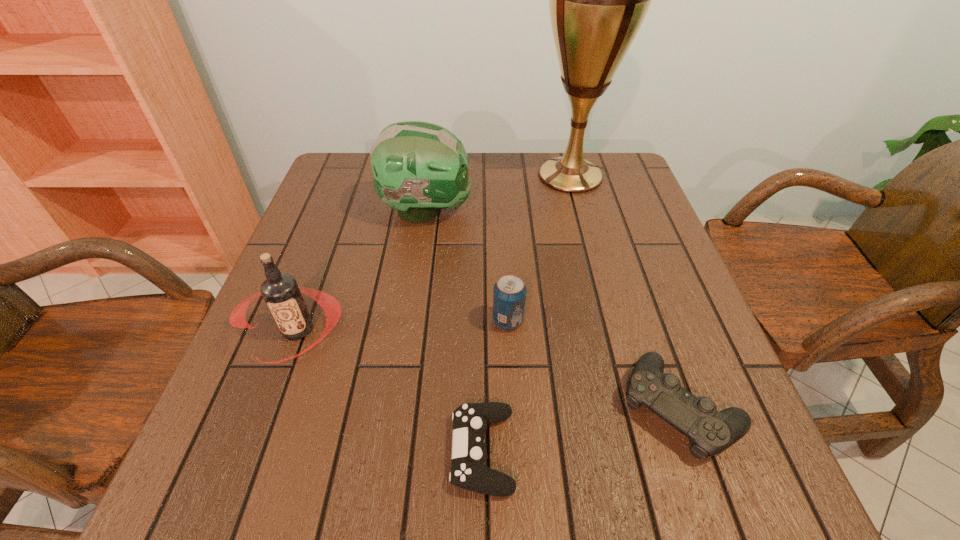
The height and width of the screenshot is (540, 960). I want to click on vacant area that lies between the fifth shortest object and the fourth tallest object, so click(467, 266).

Identify the location of vacant area between the taller control and the tallest object. The image size is (960, 540). (625, 292).

Find the location of a particular element. This screenshot has height=540, width=960. vacant space in between the tallest object and the pop soda is located at coordinates (540, 248).

Image resolution: width=960 pixels, height=540 pixels. In order to click on empty space that is in between the fourth tallest object and the leftmost object in this screenshot , I will do `click(403, 326)`.

At what (x,y) coordinates should I click in order to perform the action: click on free area in between the pop soda and the fifth tallest object. Please return your answer as a coordinate pair (x, y). This screenshot has height=540, width=960. Looking at the image, I should click on (593, 364).

Where is `free space between the trophy cup and the leftmost object`? Image resolution: width=960 pixels, height=540 pixels. free space between the trophy cup and the leftmost object is located at coordinates (434, 253).

Find the location of a particular element. The height and width of the screenshot is (540, 960). vacant region between the root beer and the taller control is located at coordinates (489, 369).

Locate an element on the screen. free space between the root beer and the fourth tallest object is located at coordinates (403, 326).

The height and width of the screenshot is (540, 960). I want to click on vacant space that's between the left control and the third shortest object, so click(x=495, y=386).

Find the location of a particular element. Image resolution: width=960 pixels, height=540 pixels. empty space between the tallest object and the second tallest object is located at coordinates (498, 193).